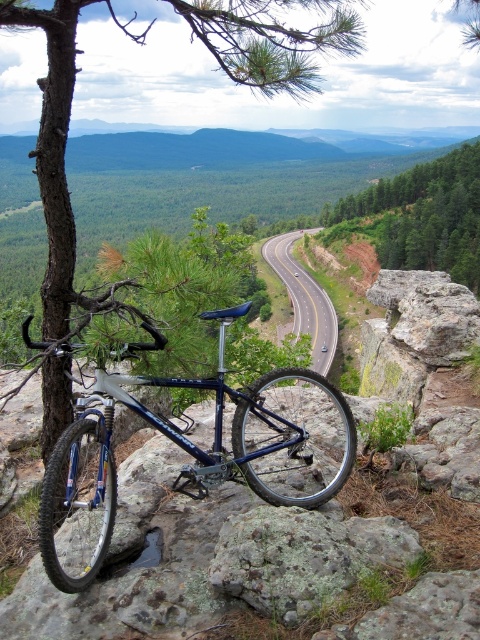
Who is more distant from viewer, (36, 12) or (315, 333)?

The point (315, 333) is behind.

Who is lower down, brown rough tree at upper left or asphalt road at center?

asphalt road at center

This screenshot has height=640, width=480. I want to click on brown rough tree at upper left, so click(x=61, y=157).

Is green leafy tree at center thinner than asphalt road at center?

In fact, green leafy tree at center might be wider than asphalt road at center.

Is green leafy tree at center closer to camera compared to asphalt road at center?

No, green leafy tree at center is further to the viewer.

Between point (364, 208) and point (320, 321), which one is positioned behind?

The point (364, 208) is behind.

You are a GUI agent. You are given a task and a screenshot of the screen. Output one action in this format:
    pyautogui.click(x=<x>, y=<y>)
    Task: Click on the green leafy tree at center
    The height and width of the screenshot is (640, 480).
    Given the screenshot: What is the action you would take?
    pyautogui.click(x=421, y=216)

Who is more distant from viewer, (254,550) or (348,221)?

The point (348,221) is more distant.

Is green mossy rock at center below green leafy tree at center?

Indeed, green mossy rock at center is positioned under green leafy tree at center.

Identify the location of green mossy rock at center. This screenshot has height=640, width=480. (302, 556).

The image size is (480, 640). In order to click on green mossy rock at center in this screenshot , I will do `click(302, 556)`.